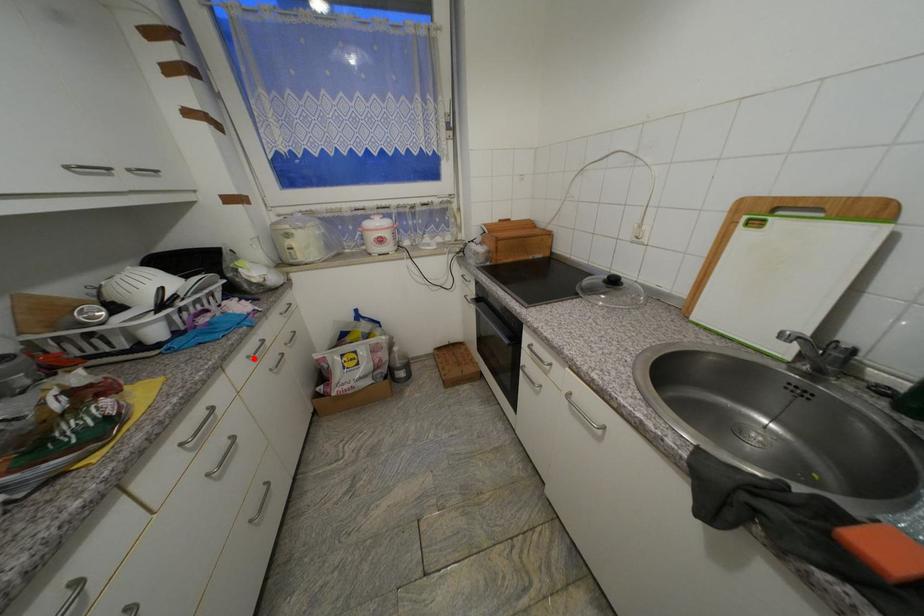
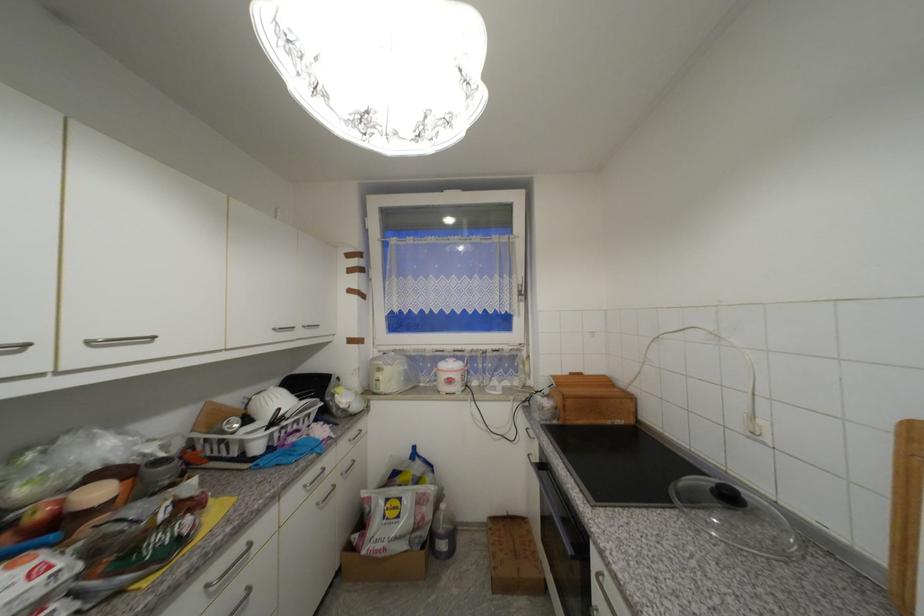
Where in the second image is the point corresponding to the highlighted location from the first image?

(310, 488)